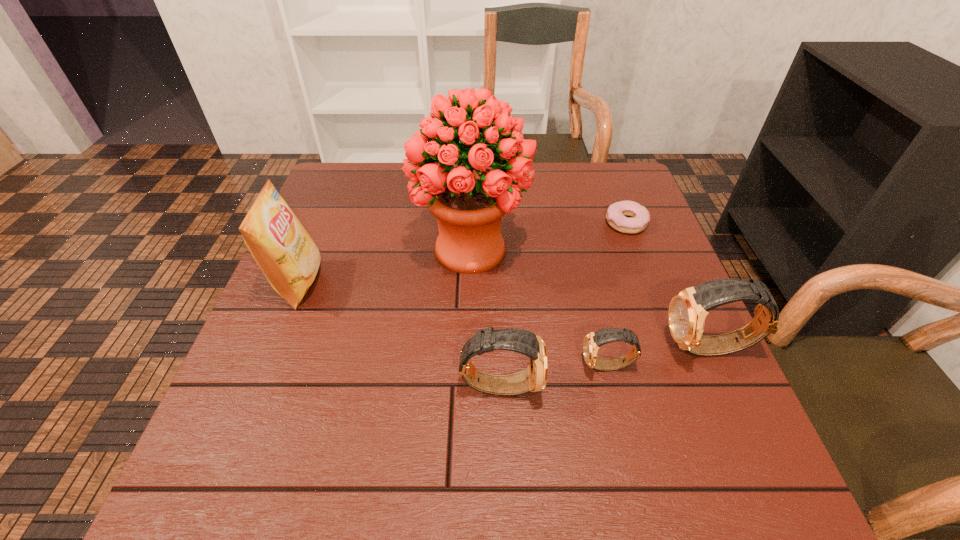
Identify which watch is the second closest to the fifth tallest object. Please provide its 2D coordinates. Your answer should be formatted as a tuple, i.e. [(x, y)], where the tuple contains the x and y coordinates of a point satisfying the conditions above.

[(534, 378)]

Choose which watch is the nearest neighbor to the shortest object. Please provide its 2D coordinates. Your answer should be formatted as a tuple, i.e. [(x, y)], where the tuple contains the x and y coordinates of a point satisfying the conditions above.

[(688, 309)]

Where is `vacant space that satisfies the following two spatial constraints: 1. on the front side of the shortest object; 2. on the face of the third shortest object`? This screenshot has height=540, width=960. vacant space that satisfies the following two spatial constraints: 1. on the front side of the shortest object; 2. on the face of the third shortest object is located at coordinates (687, 385).